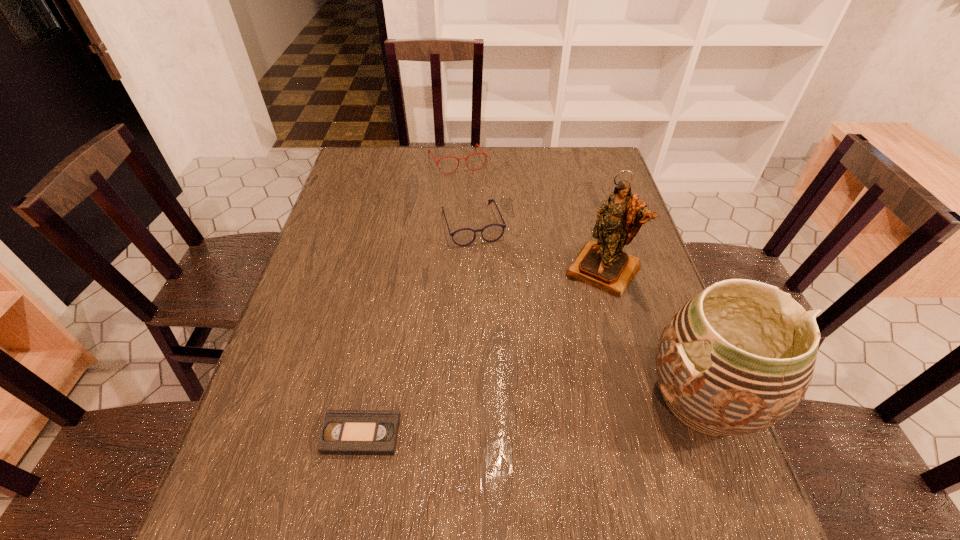
In order to click on blank area located 0.380m on the face of the farther spectacles in this screenshot , I will do `click(496, 248)`.

The width and height of the screenshot is (960, 540). In order to click on vacant space located 0.260m on the face of the farther spectacles in this screenshot , I will do `click(485, 222)`.

The image size is (960, 540). I want to click on free space located on the face of the farther spectacles, so click(x=472, y=192).

This screenshot has height=540, width=960. I want to click on vacant area situated 0.390m on the front-facing side of the nearer spectacles, so click(520, 362).

The height and width of the screenshot is (540, 960). Identify the location of free space located on the front-facing side of the nearer spectacles. (488, 269).

Where is `vacant space located 0.380m on the front-facing side of the nearer spectacles`? The image size is (960, 540). vacant space located 0.380m on the front-facing side of the nearer spectacles is located at coordinates pos(518,359).

Locate an element on the screen. This screenshot has width=960, height=540. object present at the far edge is located at coordinates (429, 151).

In order to click on videotape located at the near edge in this screenshot , I will do `click(344, 432)`.

Identify the location of pottery present at the near edge. The image size is (960, 540). (738, 357).

This screenshot has width=960, height=540. Identify the location of object situated at the left edge. (344, 432).